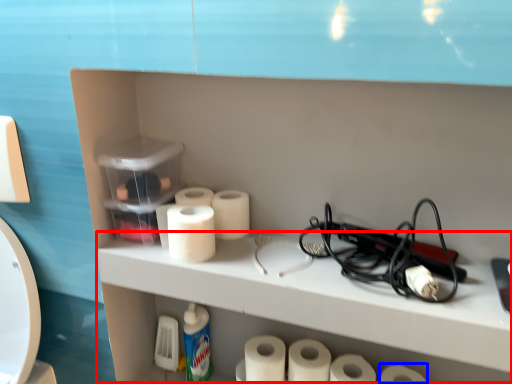
Question: Which object appears farthest to the camera in this image, counter (highlighted by a red box) or toilet paper (highlighted by a blue box)?

Choices:
 (A) counter
 (B) toilet paper

Answer: (B)